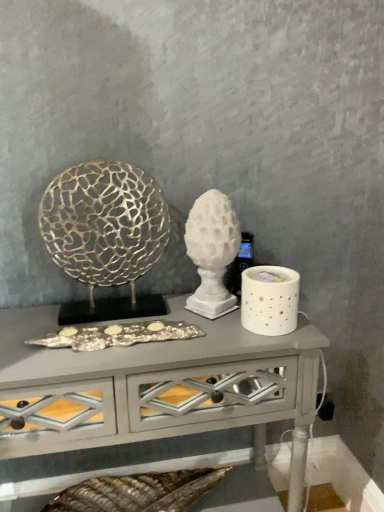
This screenshot has height=512, width=384. In order to click on vacant space positioned to the left of white ceramic candle holder at right in this screenshot , I will do `click(210, 338)`.